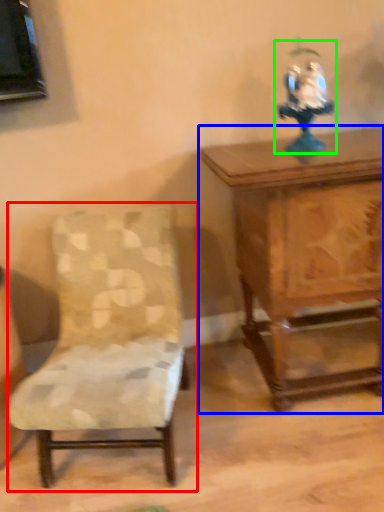
Question: Which is nearer to the chair (highlighted by a red box)? table (highlighted by a blue box) or toy (highlighted by a green box).

Choices:
 (A) table
 (B) toy

Answer: (A)